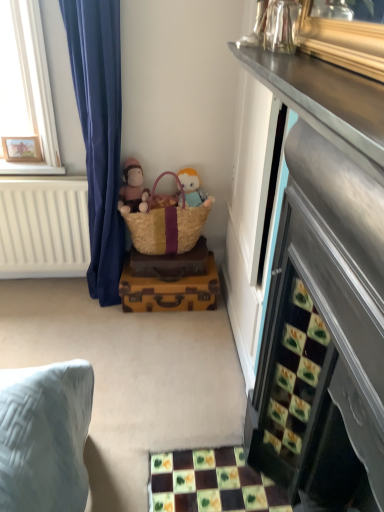
Question: Can you confirm if vintage brown suitcase at center is shorter than brown woven picnic basket at center?

Choices:
 (A) yes
 (B) no

Answer: (A)

Question: Does vintage brown suitcase at center have a smaller size compared to brown woven picnic basket at center?

Choices:
 (A) no
 (B) yes

Answer: (B)

Question: Is the depth of vintage brown suitcase at center less than that of brown woven picnic basket at center?

Choices:
 (A) yes
 (B) no

Answer: (B)

Question: From the image's perspective, is vintage brown suitcase at center on brown woven picnic basket at center?

Choices:
 (A) yes
 (B) no

Answer: (B)

Question: Does vintage brown suitcase at center have a lesser width compared to brown woven picnic basket at center?

Choices:
 (A) yes
 (B) no

Answer: (B)

Question: Is point (185, 230) closer or farther from the camera than point (185, 193)?

Choices:
 (A) farther
 (B) closer

Answer: (B)

Question: Considering the positions of brown woven picnic basket at center and soft plush toy at center in the image, is brown woven picnic basket at center taller or shorter than soft plush toy at center?

Choices:
 (A) short
 (B) tall

Answer: (B)

Question: Considering their positions, is brown woven picnic basket at center located in front of or behind soft plush toy at center?

Choices:
 (A) front
 (B) behind

Answer: (A)

Question: Is brown woven picnic basket at center bigger or smaller than soft plush toy at center?

Choices:
 (A) small
 (B) big

Answer: (B)

Question: Is vintage brown suitcase at center bigger or smaller than brown woven picnic basket at center?

Choices:
 (A) small
 (B) big

Answer: (A)

Question: From the image's perspective, is vintage brown suitcase at center located above or below brown woven picnic basket at center?

Choices:
 (A) above
 (B) below

Answer: (B)

Question: Would you say vintage brown suitcase at center is inside or outside brown woven picnic basket at center?

Choices:
 (A) outside
 (B) inside

Answer: (A)

Question: From their relative heights in the image, would you say vintage brown suitcase at center is taller or shorter than brown woven picnic basket at center?

Choices:
 (A) short
 (B) tall

Answer: (A)

Question: Does point coord(130,160) appear closer or farther from the camera than point coord(188,215)?

Choices:
 (A) closer
 (B) farther

Answer: (B)

Question: From the image's perspective, is soft brown plush at lower center above or below brown woven picnic basket at center?

Choices:
 (A) above
 (B) below

Answer: (A)